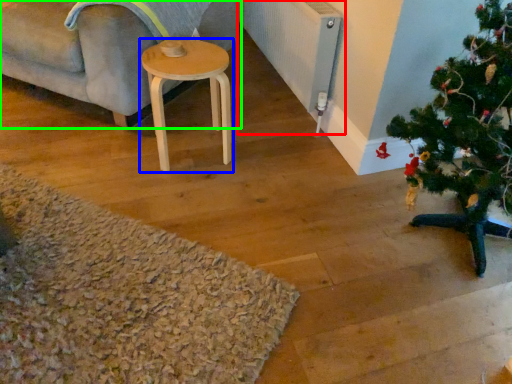
Question: Which object is the farthest from radiator (highlighted by a red box)? Choose among these: stool (highlighted by a blue box) or studio couch (highlighted by a green box).

Choices:
 (A) stool
 (B) studio couch

Answer: (B)